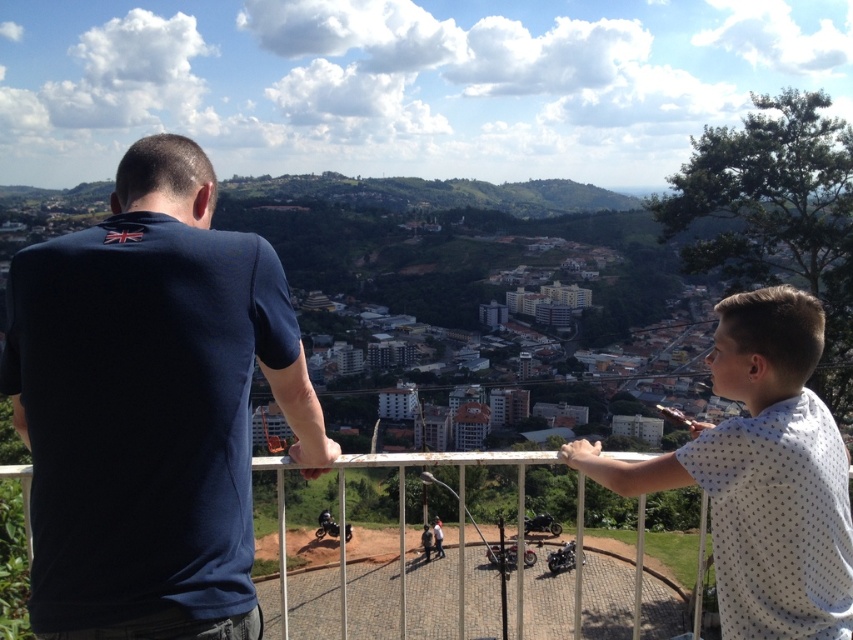
Looking at this image, you are taking a photo of the two people at the overlook. The camera is positioned to focus on the point closer to it. Which of the two points, point (16, 394) or point (524, 612), should you focus on to ensure the people are in sharp focus?

Point (16, 394) is closer to the camera than point (524, 612), so focusing on point (16, 394) will ensure the people are in sharp focus.

You are a photographer trying to capture a shot of the brown dirt track at center from the scenic overlook. The white dotted shirt at upper right is blocking your view. Can you move to the left or right to avoid it?

The white dotted shirt at upper right is above the brown dirt track at center, so moving to the left or right might not help since the shirt is directly above the track. Consider moving forward or backward instead.

In the scene shown: You are a tour guide planning a walking tour route. You need to know the distance between the white dotted shirt at upper right and the shiny black motorcycle at center to ensure visitors can comfortably walk between them. Is the distance more than 100 meters?

The distance between the white dotted shirt at upper right and the shiny black motorcycle at center is 100.39 meters, which is just over 100 meters. Visitors can comfortably walk the distance as it is slightly more than 100 meters.